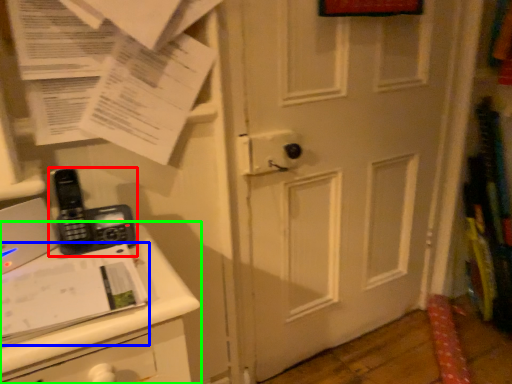
Question: Which object is the farthest from corded phone (highlighted by a red box)? Choose among these: journal (highlighted by a blue box) or changing table (highlighted by a green box).

Choices:
 (A) journal
 (B) changing table

Answer: (B)